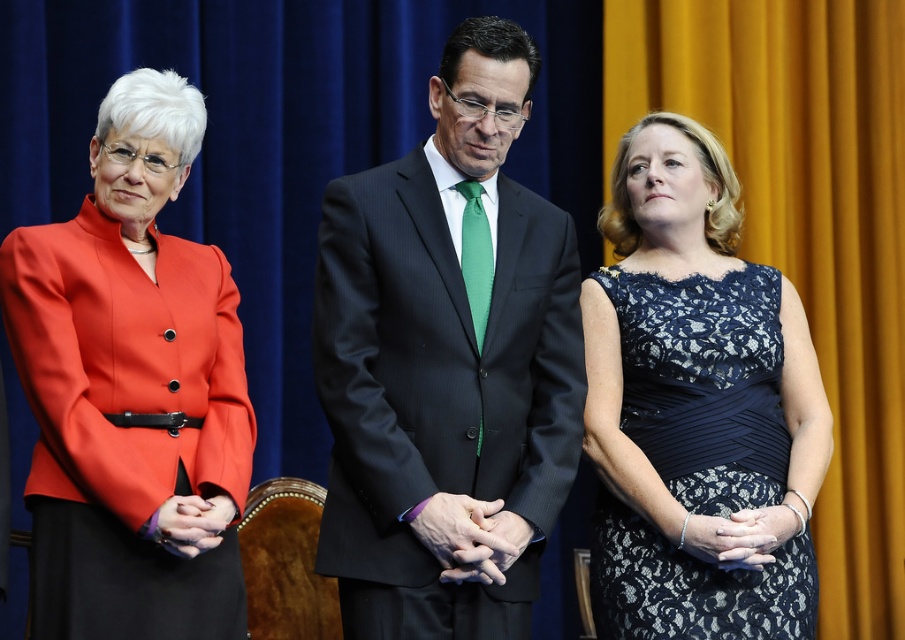
You are a photographer setting up for a group photo. You notice the lace fabric dress at center and the silver metallic bracelet at center in the scene. Which object should you focus on if you want to capture the taller one?

The lace fabric dress at center is taller than the silver metallic bracelet at center, so you should focus on the lace fabric dress at center.

You are a photographer adjusting the lighting for a portrait session. You notice the silver metallic bracelet at center and the matte black hands at center. Which object is closer to the camera lens?

The silver metallic bracelet at center is closer to the camera lens because the matte black hands at center are behind it.

Consider the image. You are a photographer setting up for a group photo. You notice the matte red jacket at left and the lace fabric dress at center. Which clothing item is covering part of the other?

The matte red jacket at left is positioned over the lace fabric dress at center, so the matte red jacket at left is covering part of the lace fabric dress at center.